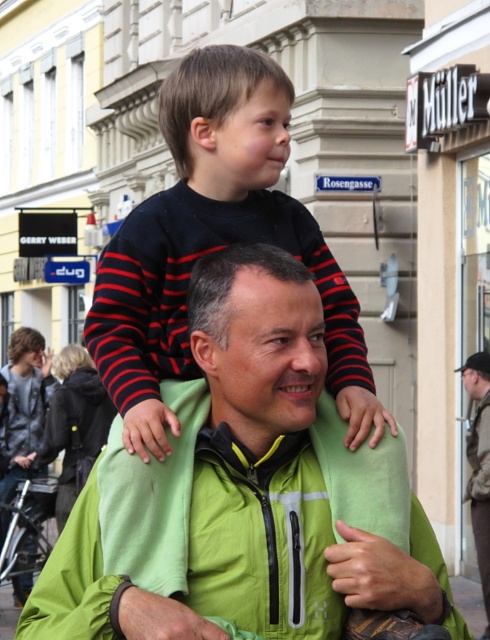
Which is behind, point (269, 429) or point (140, 305)?

Point (140, 305)

At what (x,y) coordinates should I click in order to perform the action: click on green soft jacket at center. Please return your answer as a coordinate pair (x, y). The image size is (490, 640). Looking at the image, I should click on (243, 492).

Is point (212, 532) farther from camera compared to point (211, 86)?

No, it is not.

The height and width of the screenshot is (640, 490). I want to click on green soft jacket at center, so click(243, 492).